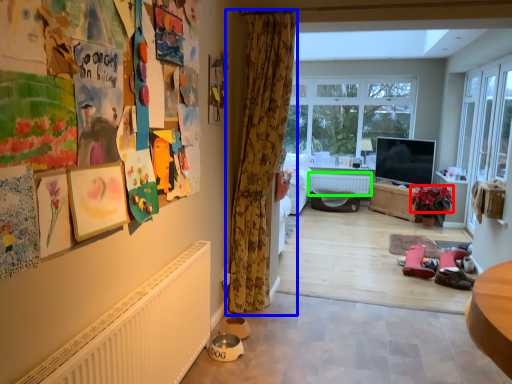
Question: Estimate the real-world distances between objects in this image. Which object is closer to flower (highlighted by a red box), curtain (highlighted by a blue box) or radiator (highlighted by a green box)?

Choices:
 (A) curtain
 (B) radiator

Answer: (B)